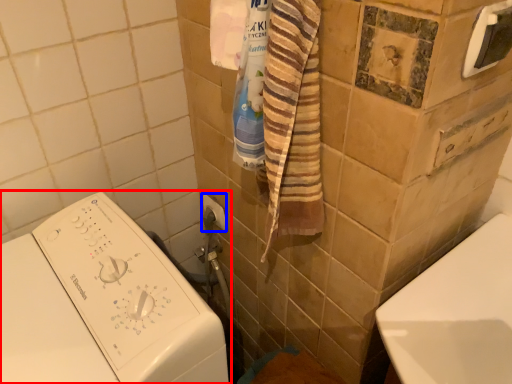
Question: Which object appears farthest to the camera in this image, washing machine (highlighted by a red box) or towel bar (highlighted by a blue box)?

Choices:
 (A) washing machine
 (B) towel bar

Answer: (B)